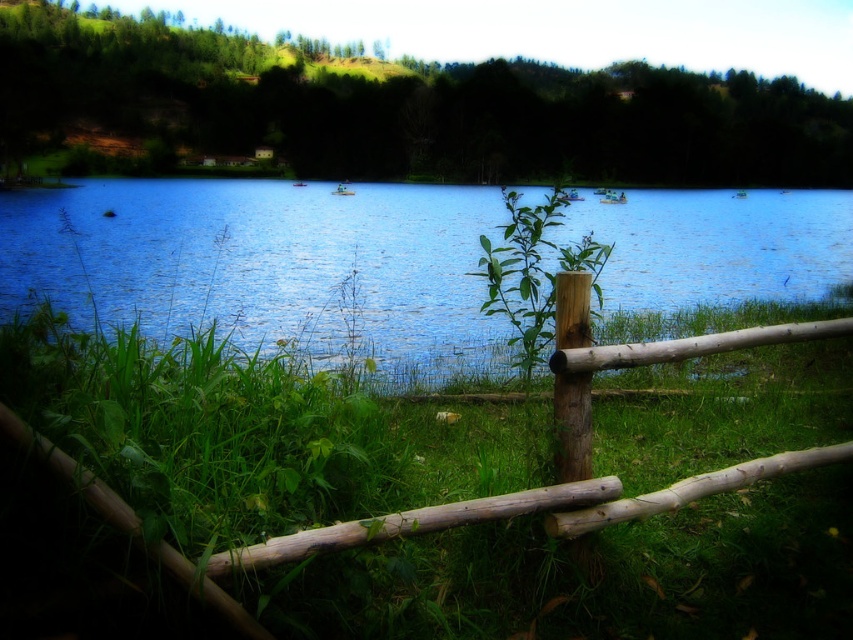
You are standing at the edge of the lake and want to reach the blue water at center without stepping on the green rough grass at lower center. Is there enough space between them to walk around?

The green rough grass at lower center is 10.56 meters away from the blue water at center, so there is sufficient space to walk around without stepping on the grass.

You are standing at the edge of the lake and see the green rough grass at lower center and the blue water at center. Which object is closer to your feet?

The green rough grass at lower center is closer to your feet since it is positioned below the blue water at center.

You are standing at the origin point in the scene. Where is the blue water at center located in coordinates?

The blue water at center is located at coordinates point (267, 266).